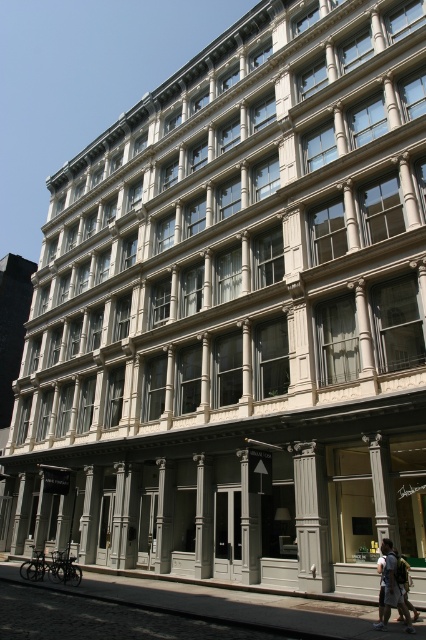
You are standing in front of the building and notice a specific point marked at coordinates (310, 516). Based on the scene description, what object is located at this point?

The point at (310, 516) indicates a white painted wood column at center.

You are standing in front of the building and notice a white painted wood column at center and a white cotton backpack at center. Which object is closer to you?

The white cotton backpack at center is closer because the white painted wood column at center is positioned over it, indicating it is behind the backpack.